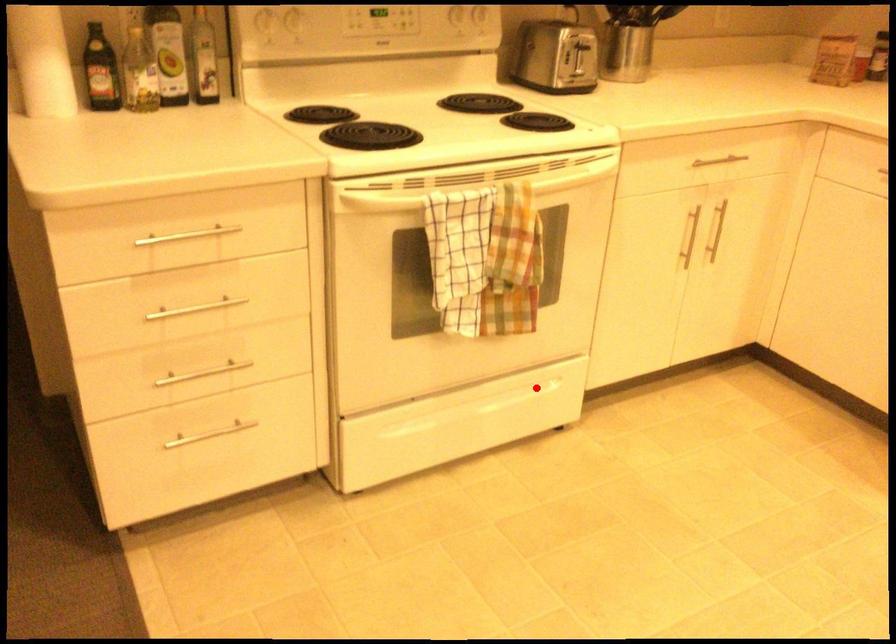
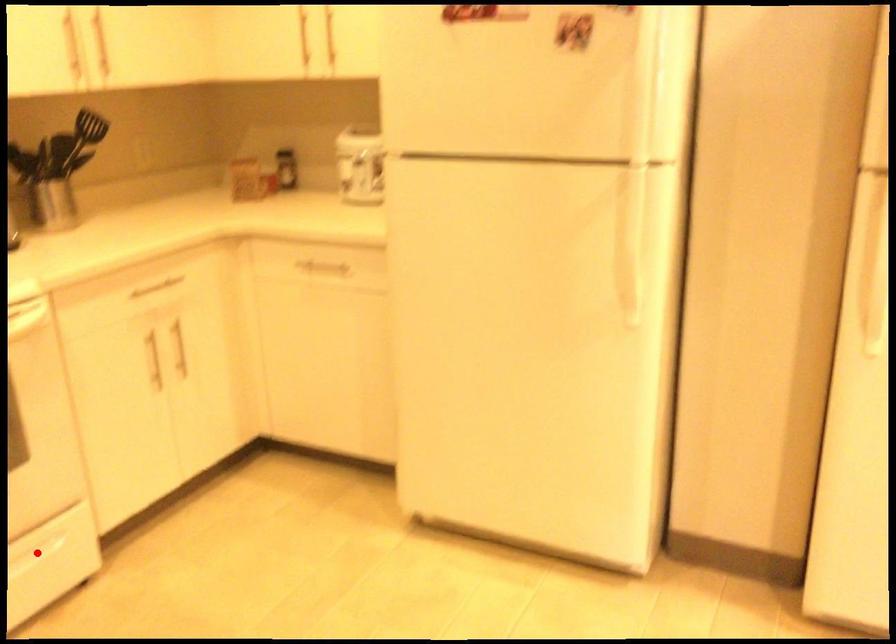
I am providing you with two images of the same scene from different viewpoints. A red point is marked on the first image and another point is marked on the second image. Does the point marked in image1 correspond to the same location as the one in image2?

Yes